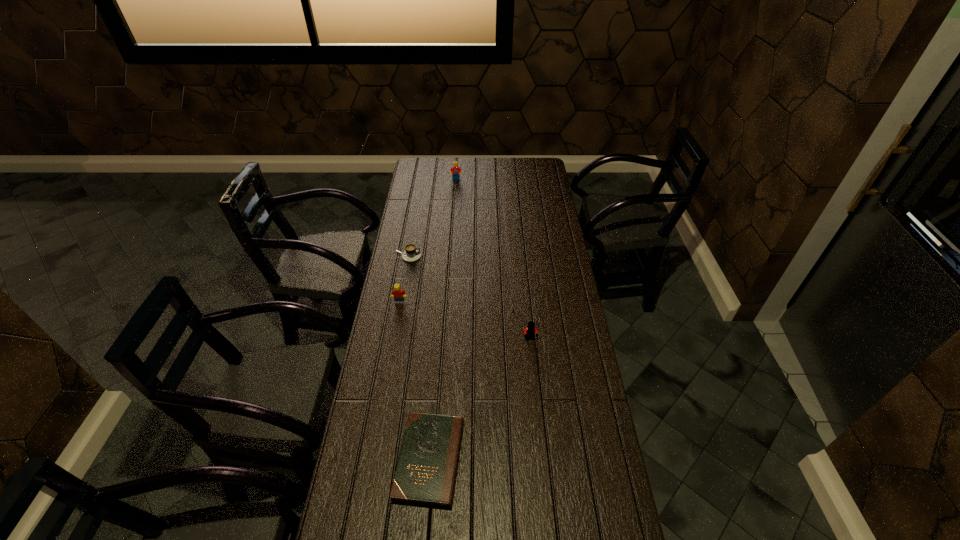
This screenshot has height=540, width=960. What are the coordinates of `free area in between the Bible and the second shortest object` in the screenshot? It's located at (419, 358).

Find the location of a particular element. Image resolution: width=960 pixels, height=540 pixels. free point between the leftmost Lego and the second Lego from right to left is located at coordinates (428, 241).

Where is `object that is the closest to the second Lego from right to left`? object that is the closest to the second Lego from right to left is located at coordinates pos(412,253).

Find the location of a particular element. This screenshot has height=540, width=960. object that is the second closest to the nearest object is located at coordinates (398, 294).

The image size is (960, 540). I want to click on Lego that is the closest one to the second farthest object, so click(x=398, y=294).

You are a GUI agent. You are given a task and a screenshot of the screen. Output one action in this format:
    pyautogui.click(x=<x>, y=<y>)
    Task: Click on the Lego identified as the third closest to the shortest object
    The width and height of the screenshot is (960, 540).
    Given the screenshot: What is the action you would take?
    pyautogui.click(x=455, y=171)

This screenshot has width=960, height=540. In order to click on free space that satisfies the following two spatial constraints: 1. with the handle on the side of the fourth nearest object; 2. on the front-facing side of the third farthest object in this screenshot , I will do `click(399, 302)`.

At what (x,y) coordinates should I click in order to perform the action: click on free space that satisfies the following two spatial constraints: 1. on the front-facing side of the second farthest Lego; 2. on the right side of the nearest object. Please return your answer as a coordinate pair (x, y). The width and height of the screenshot is (960, 540). Looking at the image, I should click on (372, 460).

Identify the location of free space that satisfies the following two spatial constraints: 1. on the front-facing side of the shortest object; 2. on the right side of the second farthest Lego. (372, 460).

Identify the location of vacant area in the image that satisfies the following two spatial constraints: 1. with the handle on the side of the nearest object; 2. on the left side of the fourth nearest object. The height and width of the screenshot is (540, 960). (372, 460).